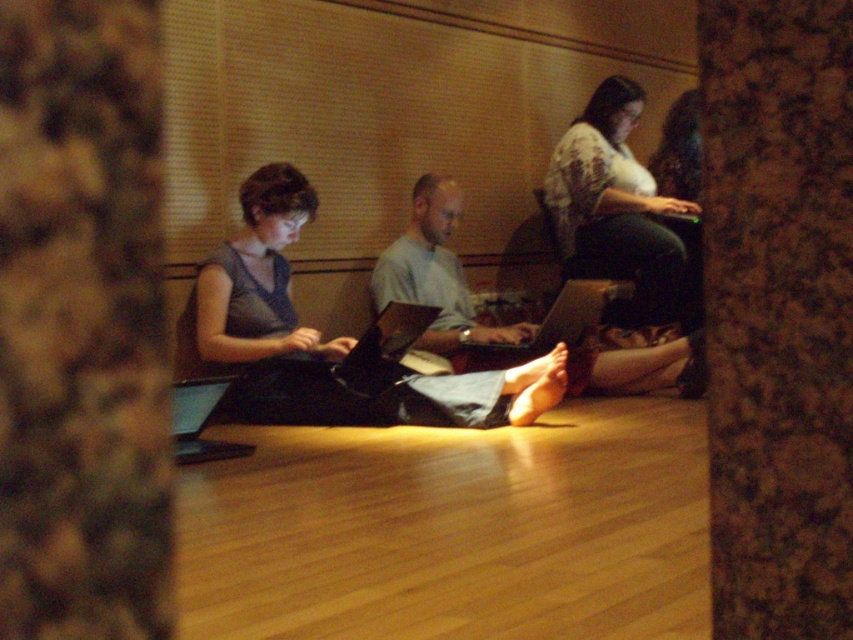
You are a photographer trying to capture a candid shot of the light blue fabric pants at center and the black glossy laptop at lower left. Since the lighting is dim, you need to adjust your camera settings. However, you also want to ensure that both subjects are in focus. Given their positions, which subject should you focus on to ensure both are sharp?

You should focus on the black glossy laptop at lower left because the light blue fabric pants at center is located above it, so focusing on the closer object will keep both in focus.